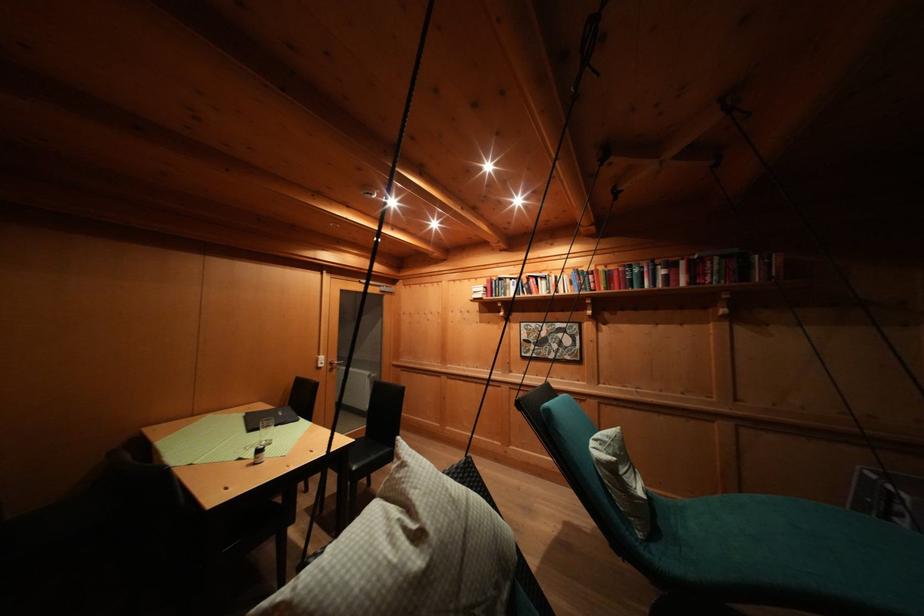
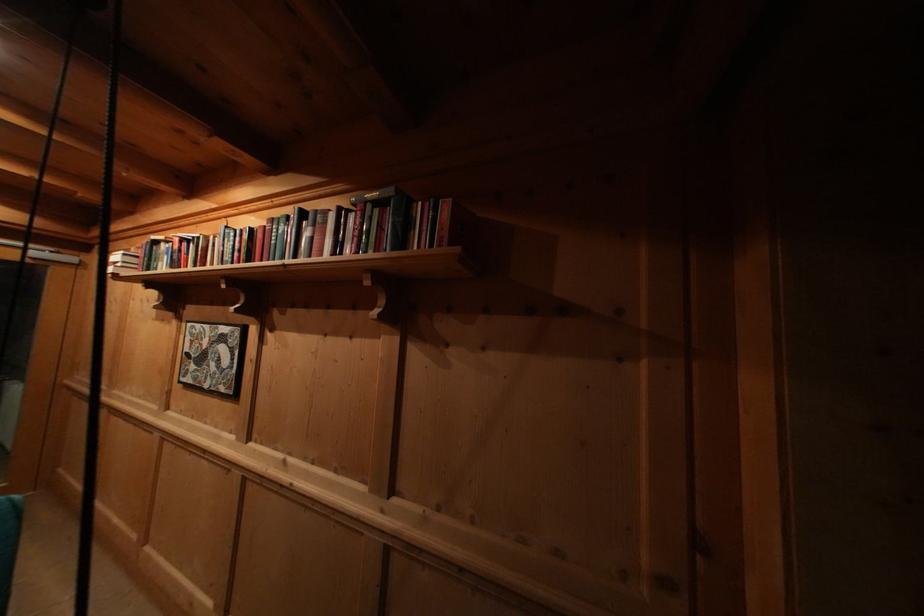
What movement of the cameraman would produce the second image?

The cameraman moved toward right, forward.